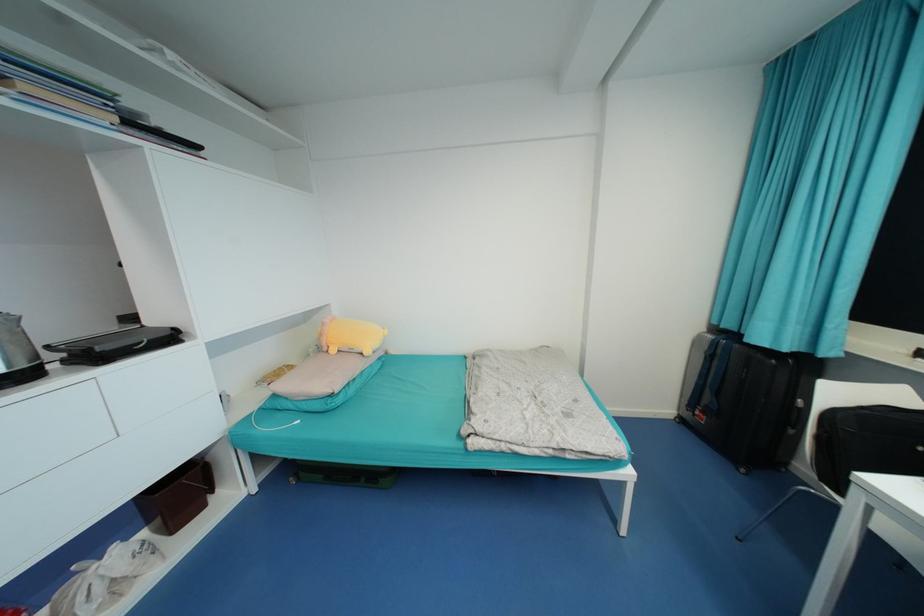
Where is `white drawer front`? The height and width of the screenshot is (616, 924). white drawer front is located at coordinates (40, 426).